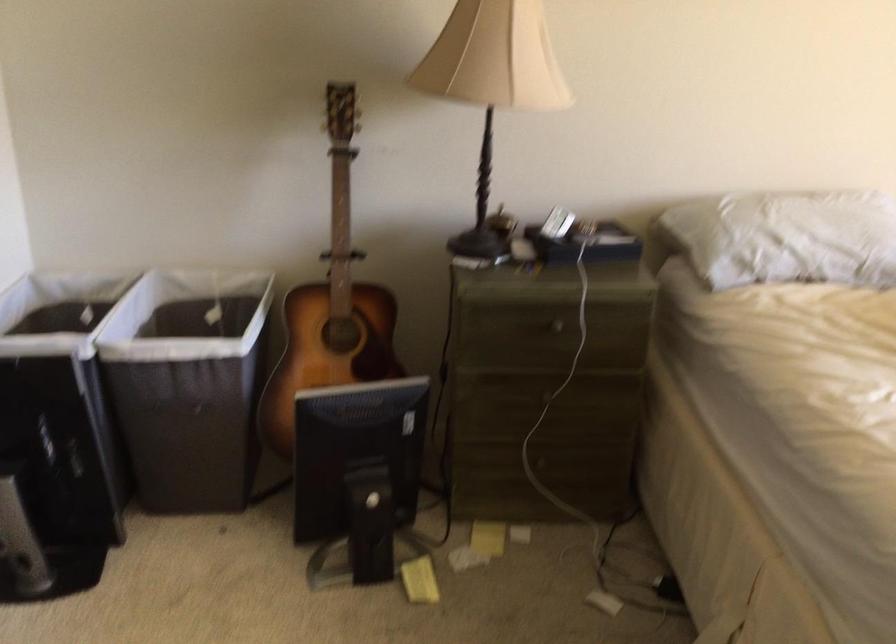
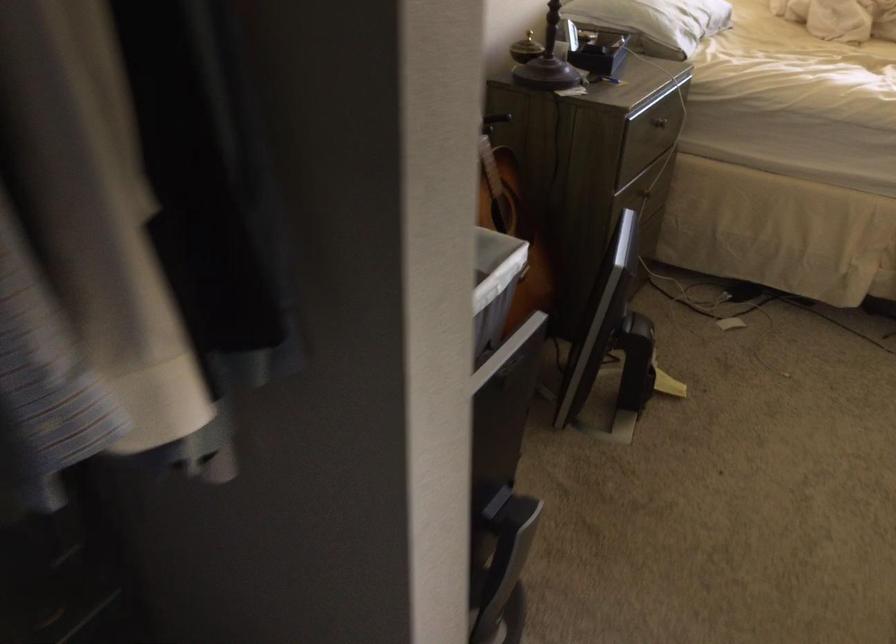
In the second image, find the point that corresponds to (705,240) in the first image.

(655, 21)